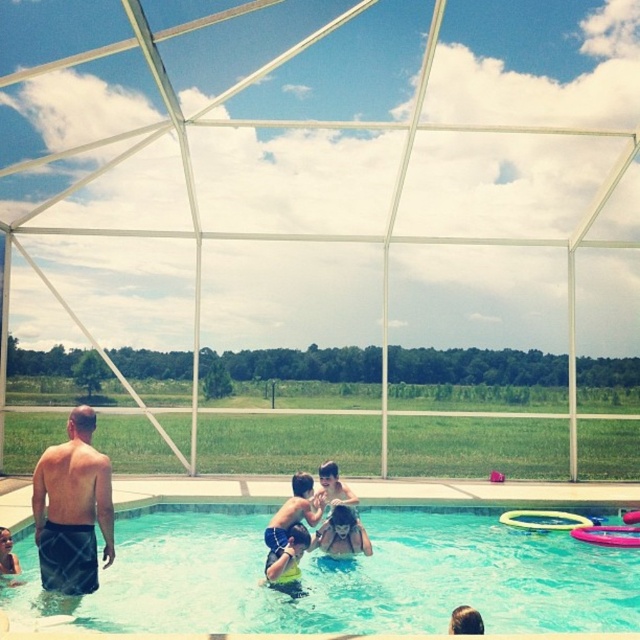
You are a photographer positioned at the edge of the pool. You want to take a photo that includes both the point at position (106, 628) and the point at position (280, 564). Which point should you focus on first to ensure both are in sharp focus?

You should focus on point (106, 628) first because it is closer to the camera than point (280, 564). By focusing on the closer point, the farther point will also be within the depth of field and appear sharp in the photo.

You are a photographer taking a picture of the swimming pool scene. You notice two points marked in the image. The first point is at coordinate point(76,451) and the second is at point(284,561). Which point will appear larger in your photo?

Point(76,451) will appear larger in the photo because it is closer to the camera than point(284,561).